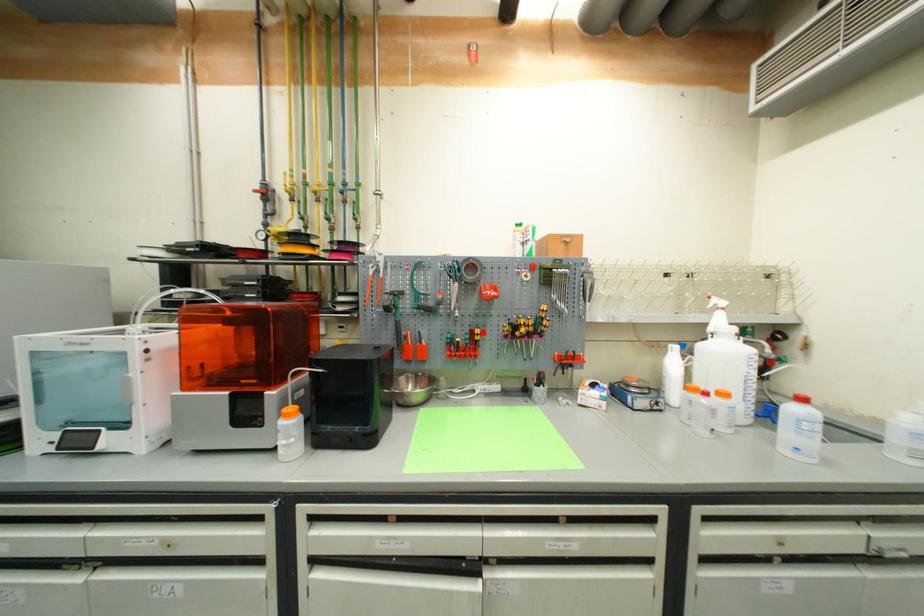
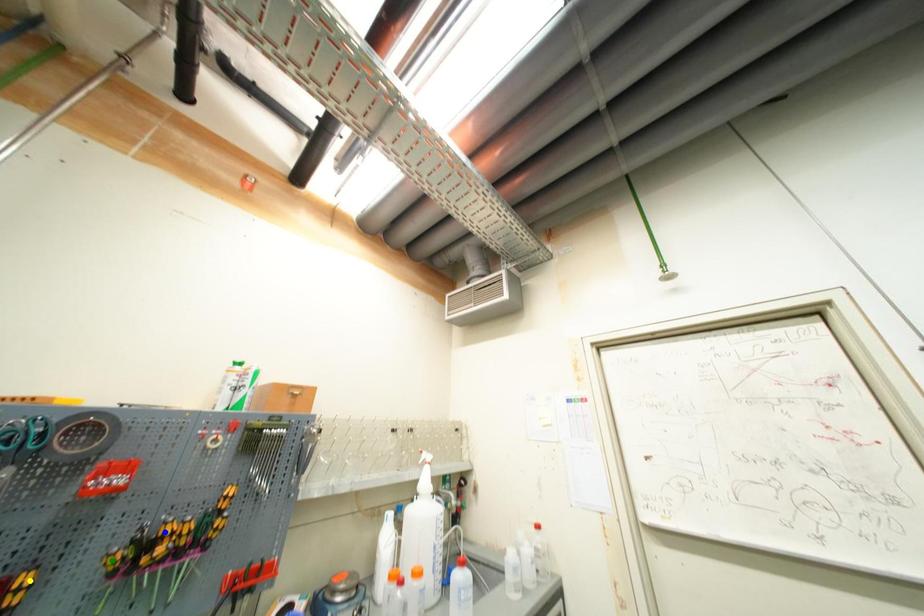
Question: I am providing you with two images of the same scene from different viewpoints. A red point is marked on the first image. You are given multiple points on the second image. Which point in image 2 is actually the same real-world point as the red point in image 1?

Choices:
 (A) yellow point
 (B) blue point
 (C) green point

Answer: (A)